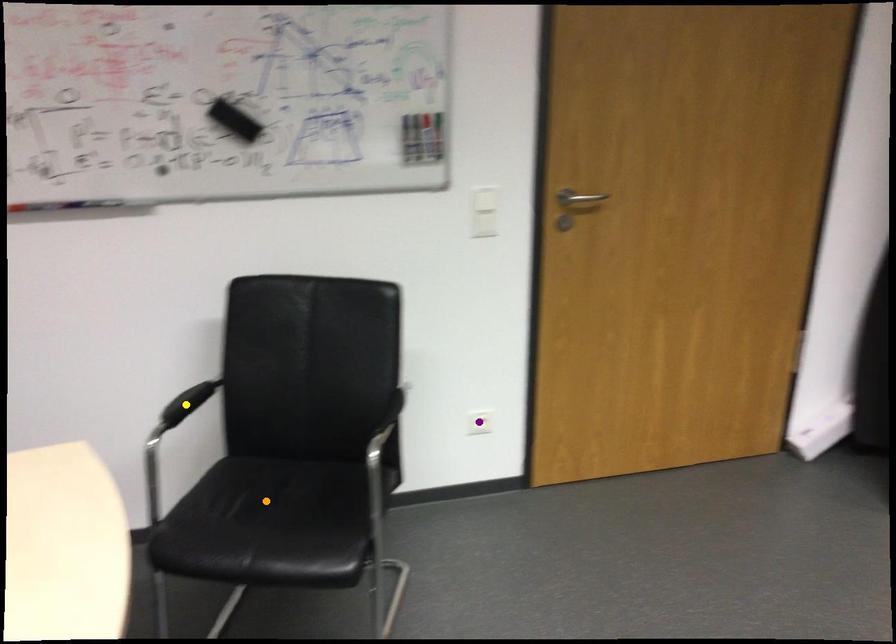
Order these from farthest to nearest:
yellow point
purple point
orange point

purple point → yellow point → orange point